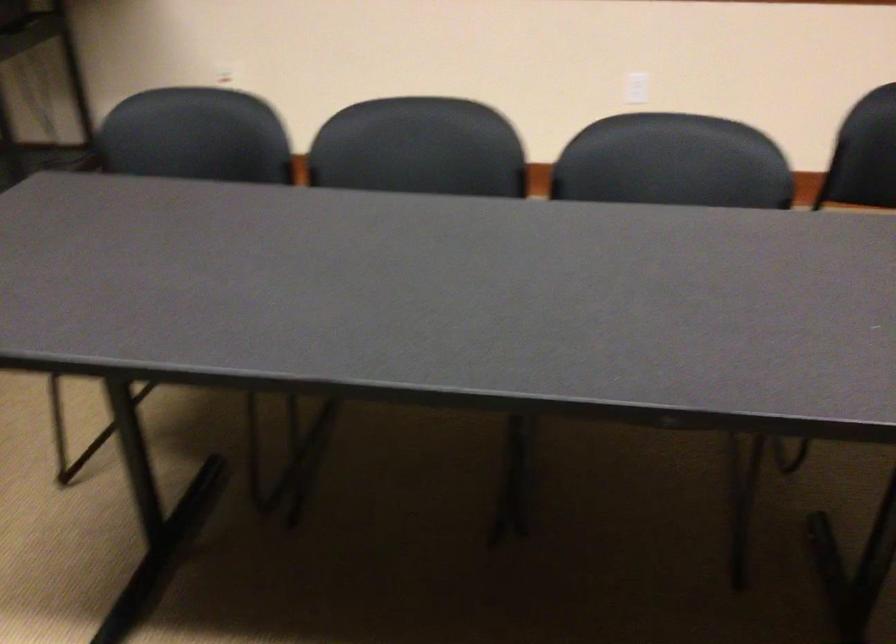
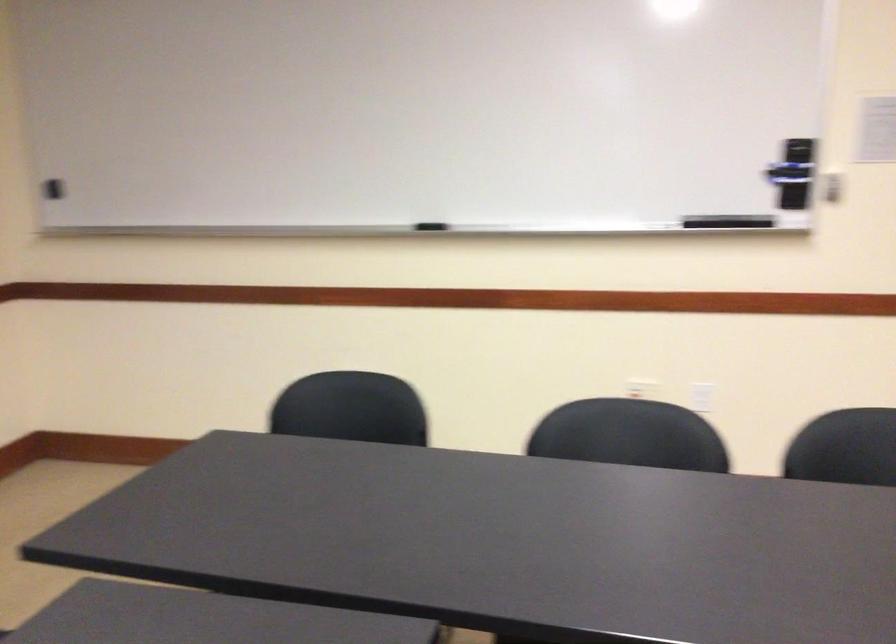
Question: The first image is from the beginning of the video and the second image is from the end. How did the camera likely rotate when shooting the video?

Choices:
 (A) Left
 (B) Right
 (C) Up
 (D) Down

Answer: (B)